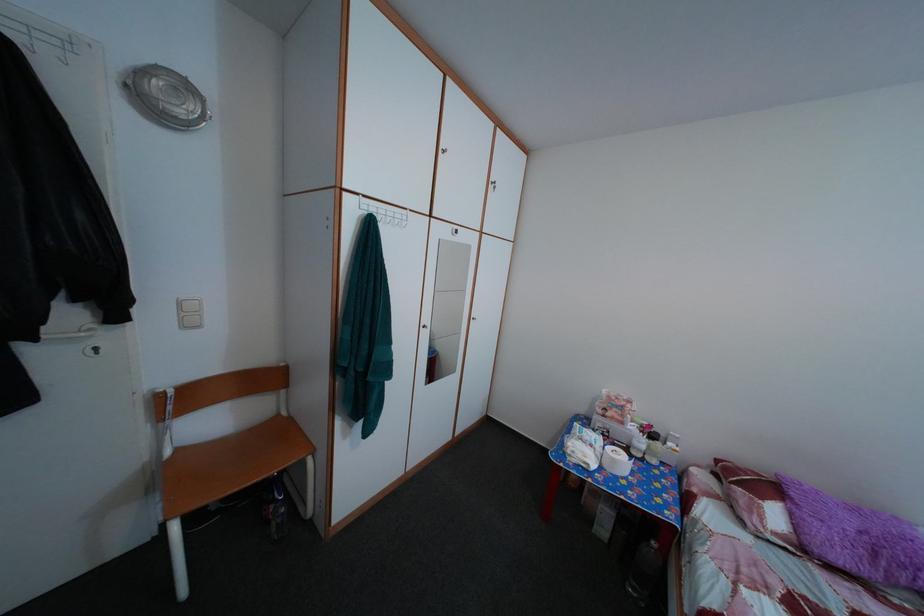
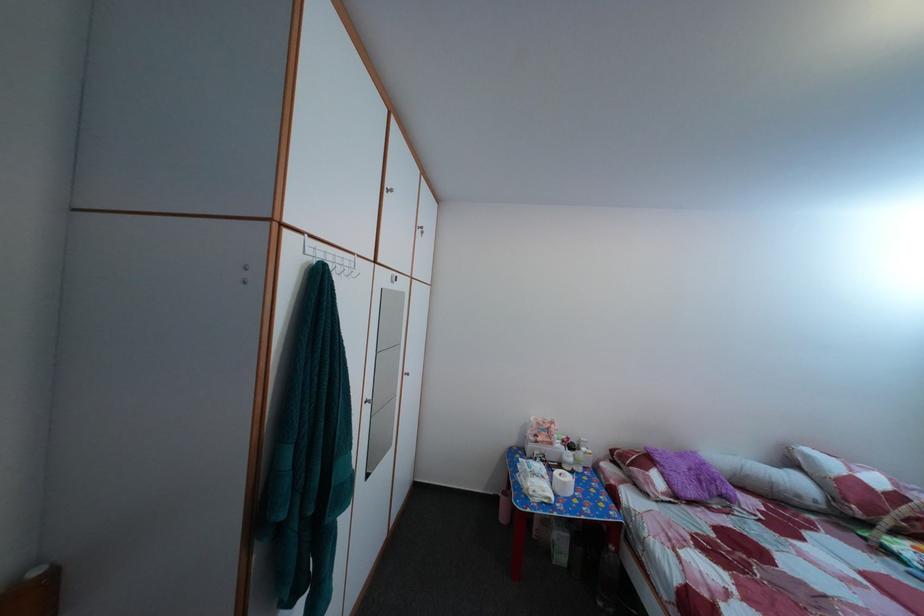
Locate, in the second image, the point that corresponds to the point at 660,435 in the first image.

(578, 447)